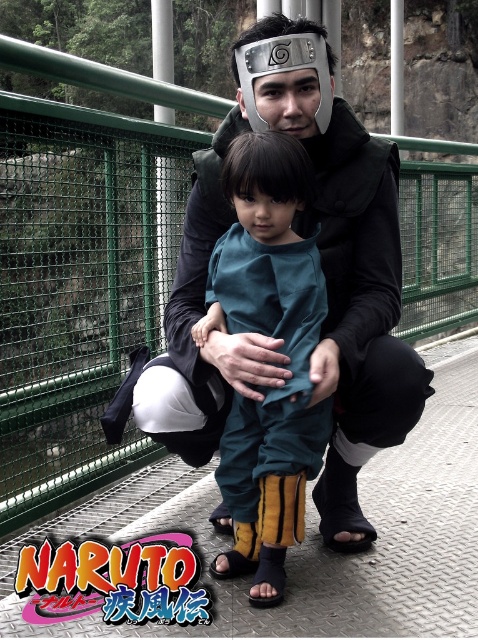
Is teal fabric pants at center below metallic silver headband at center?

Indeed, teal fabric pants at center is positioned under metallic silver headband at center.

Where is `teal fabric pants at center`? teal fabric pants at center is located at coordinates (283, 349).